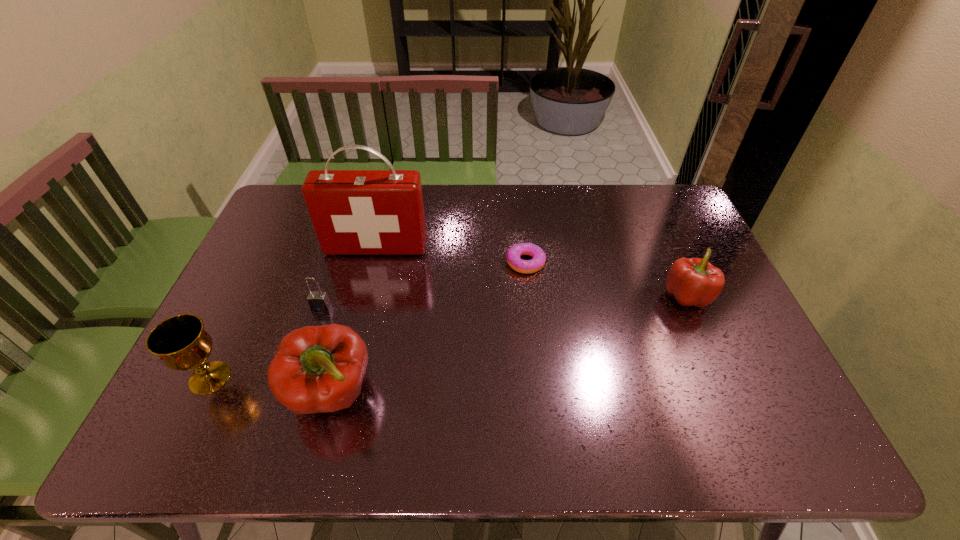
At what (x,y) coordinates should I click in order to perform the action: click on vacant region between the second object from right to left and the leftmost object. Please return your answer as a coordinate pair (x, y). Looking at the image, I should click on (x=368, y=320).

At what (x,y) coordinates should I click in order to perform the action: click on vacant point located between the doughnut and the first-aid kit. Please return your answer as a coordinate pair (x, y). The width and height of the screenshot is (960, 540). Looking at the image, I should click on (451, 255).

You are a GUI agent. You are given a task and a screenshot of the screen. Output one action in this format:
    pyautogui.click(x=<x>, y=<y>)
    Task: Click on the vacant point located between the chalice and the tallest object
    Image resolution: width=960 pixels, height=540 pixels.
    Given the screenshot: What is the action you would take?
    pyautogui.click(x=293, y=313)

This screenshot has width=960, height=540. Identify the location of vacant area between the padlock and the shorter bell pepper. (504, 302).

Locate an element on the screen. free spot between the fifth object from left to right and the first-aid kit is located at coordinates (451, 255).

Find the location of a particular element. This screenshot has width=960, height=540. vacant space that is in between the shortest object and the tallest object is located at coordinates (451, 255).

Where is `object that can be found as the fifth closest to the chalice`? The width and height of the screenshot is (960, 540). object that can be found as the fifth closest to the chalice is located at coordinates (691, 281).

Where is `object that is the nearest to the chalice`? The image size is (960, 540). object that is the nearest to the chalice is located at coordinates (316, 369).

The image size is (960, 540). In order to click on free spot that satisfies the following two spatial constraints: 1. on the front face of the first-aid kit; 2. on the left side of the rightmost object in this screenshot , I will do `click(364, 296)`.

You are a GUI agent. You are given a task and a screenshot of the screen. Output one action in this format:
    pyautogui.click(x=<x>, y=<y>)
    Task: Click on the free location that satisfies the following two spatial constraints: 1. on the back side of the left bell pepper; 2. on the left side of the farther bell pepper
    The height and width of the screenshot is (540, 960).
    Given the screenshot: What is the action you would take?
    pos(357,296)